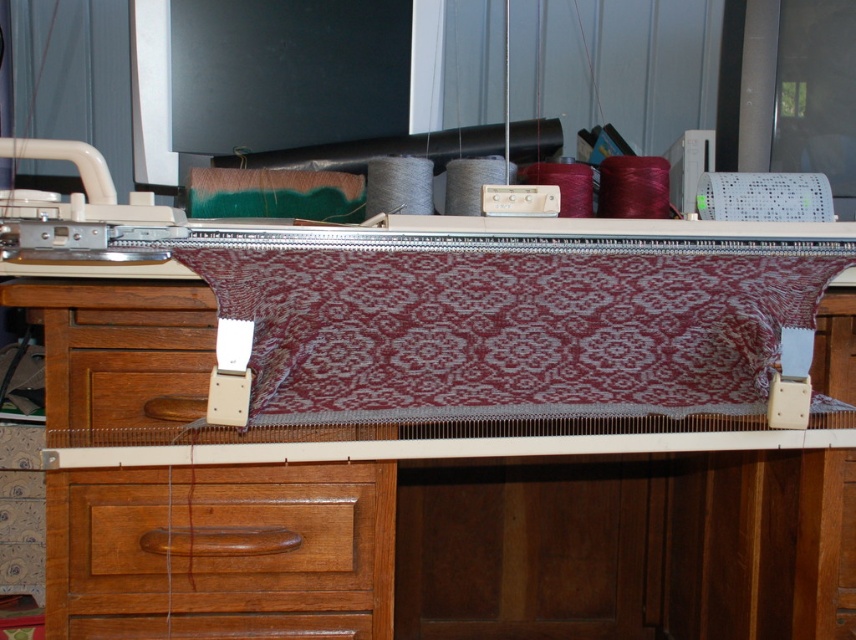
What do you see at coordinates (528, 540) in the screenshot? I see `wooden table at center` at bounding box center [528, 540].

Between wooden table at center and wooden drawer at lower left, which one appears on the right side from the viewer's perspective?

wooden table at center

Find the location of a particular element. The image size is (856, 640). wooden table at center is located at coordinates (528, 540).

Which of these two, maroon fabric at center or wooden drawer at lower left, stands taller?

wooden drawer at lower left

Is maroon fabric at center below wooden drawer at lower left?

No.

In order to click on maroon fabric at center in this screenshot , I will do `click(508, 330)`.

The image size is (856, 640). I want to click on maroon fabric at center, so click(x=508, y=330).

Does wooden table at center have a greater width compared to maroon fabric at center?

Yes, wooden table at center is wider than maroon fabric at center.

Is wooden table at center to the right of maroon fabric at center from the viewer's perspective?

Indeed, wooden table at center is positioned on the right side of maroon fabric at center.

Which is behind, point (343, 516) or point (367, 308)?

The point (343, 516) is more distant.

At what (x,y) coordinates should I click in order to perform the action: click on wooden table at center. Please return your answer as a coordinate pair (x, y). The image size is (856, 640). Looking at the image, I should click on (528, 540).